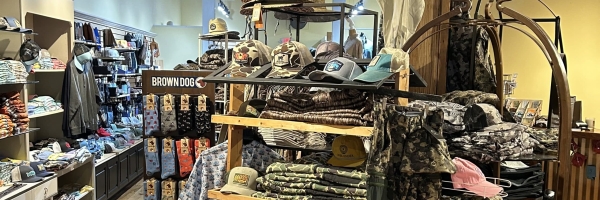
The width and height of the screenshot is (600, 200). I want to click on ceiling lights, so click(x=357, y=12), click(x=222, y=11).